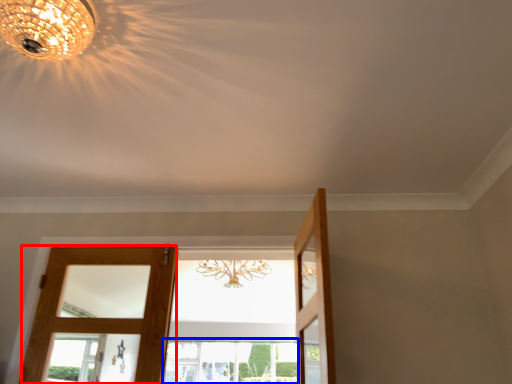
Question: Among these objects, which one is nearest to the camera, door (highlighted by a red box) or window (highlighted by a blue box)?

Choices:
 (A) door
 (B) window

Answer: (A)